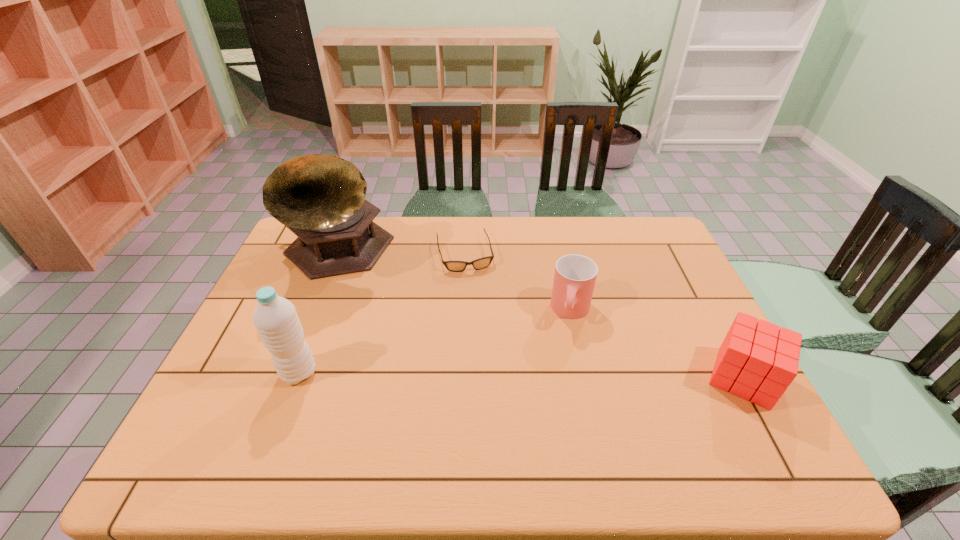
This screenshot has height=540, width=960. In order to click on water bottle positioned at the left edge in this screenshot , I will do `click(275, 318)`.

Where is `phonograph record at the left edge`? phonograph record at the left edge is located at coordinates (321, 198).

Locate an element on the screen. object at the right edge is located at coordinates (757, 361).

This screenshot has height=540, width=960. I want to click on object that is at the far left corner, so click(x=321, y=198).

What are the coordinates of `object at the near right corner` in the screenshot? It's located at (757, 361).

Locate an element on the screen. vacant region at the far edge is located at coordinates (393, 224).

At what (x,y) coordinates should I click in order to perform the action: click on free space at the near edge of the desktop. Please return your answer as a coordinate pair (x, y). This screenshot has width=960, height=540. Looking at the image, I should click on (522, 394).

Where is `vacant area at the left edge`? The height and width of the screenshot is (540, 960). vacant area at the left edge is located at coordinates (298, 286).

You are a GUI agent. You are given a task and a screenshot of the screen. Output one action in this format:
    pyautogui.click(x=<x>, y=<y>)
    Task: Click on the vacant space at the right edge of the desktop
    The width and height of the screenshot is (960, 540).
    Given the screenshot: What is the action you would take?
    pyautogui.click(x=673, y=289)

Identify the location of vacant space at the near left corner. (241, 410).